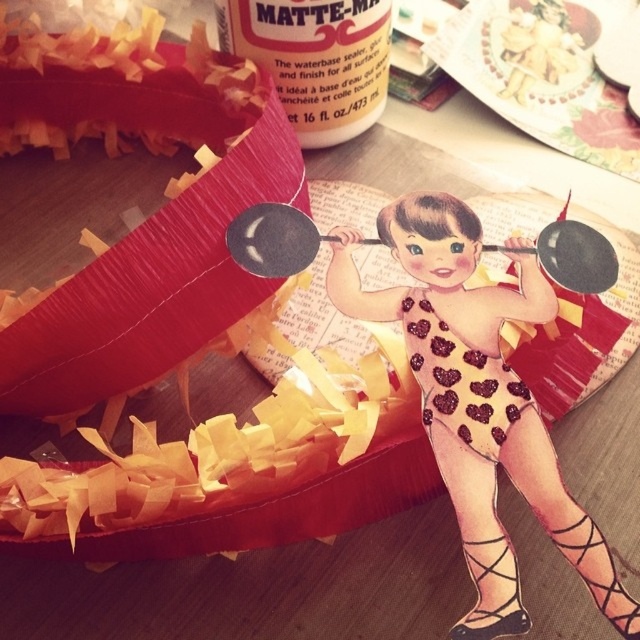
You are an interior designer planning to place a new decorative item on the wooden surface. The new item must be placed exactly at the coordinates given for the matte ceramic plate at upper center. What are the coordinates where you should place the new item?

The coordinates for the matte ceramic plate at upper center are at point [544,74], so you should place the new item at those coordinates.